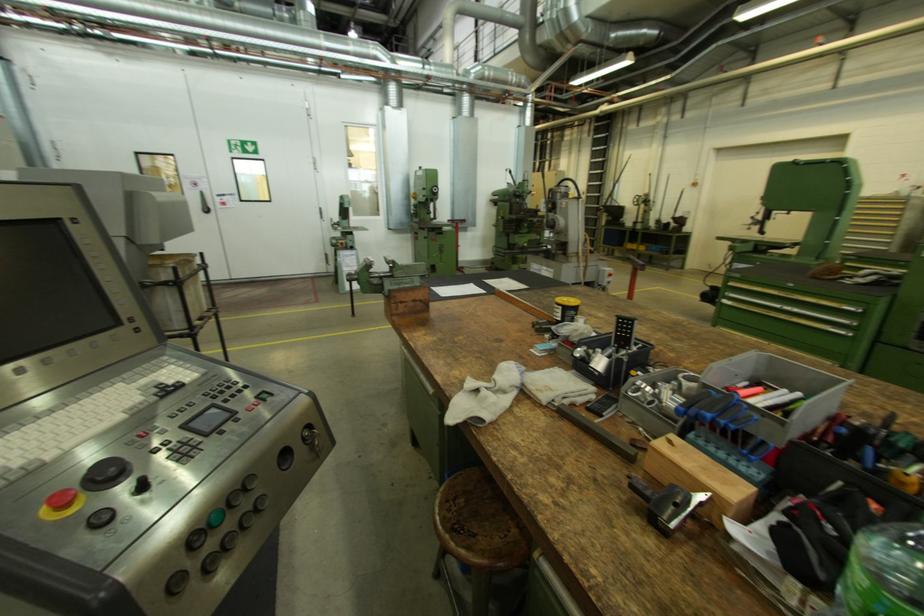
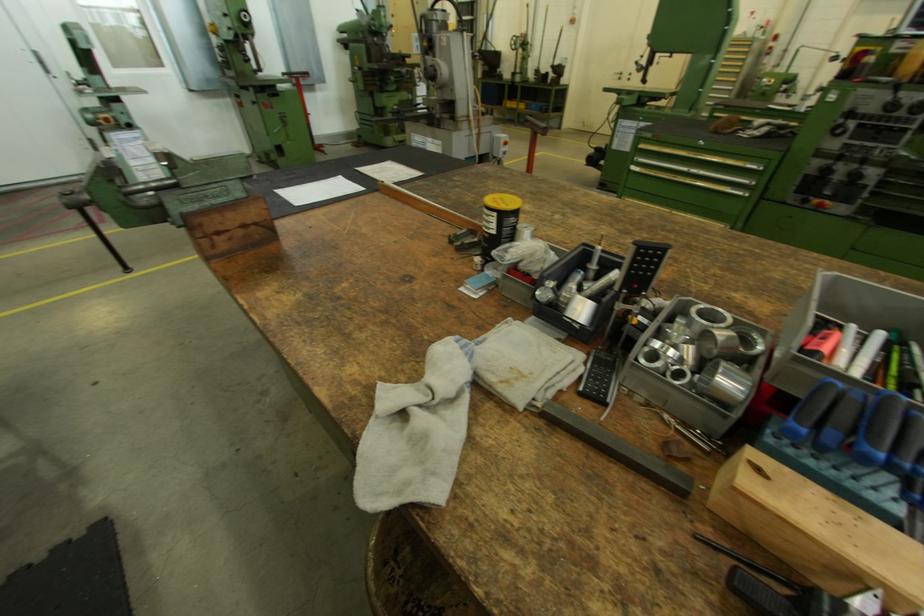
Locate, in the second image, the point that corresponds to point 578,302 in the first image.

(516, 203)